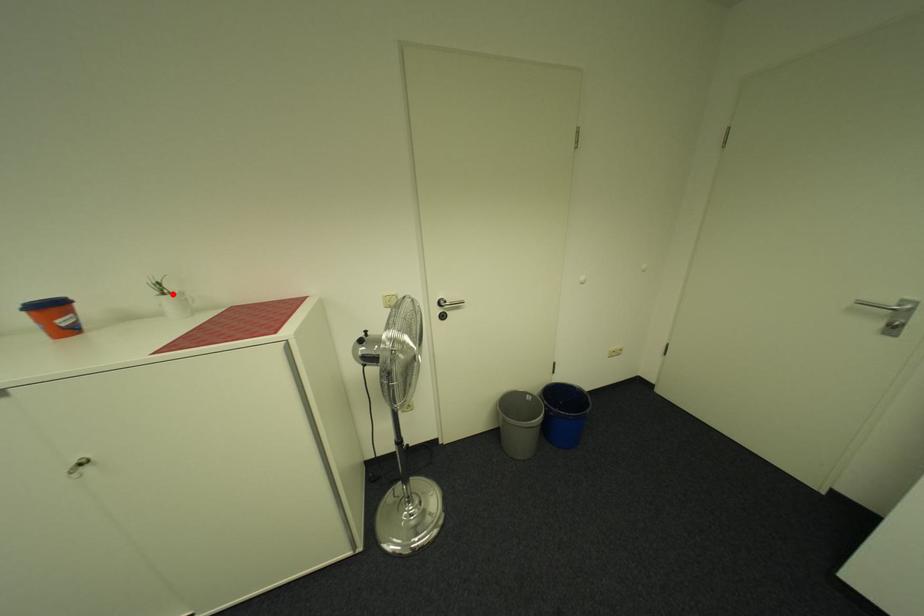
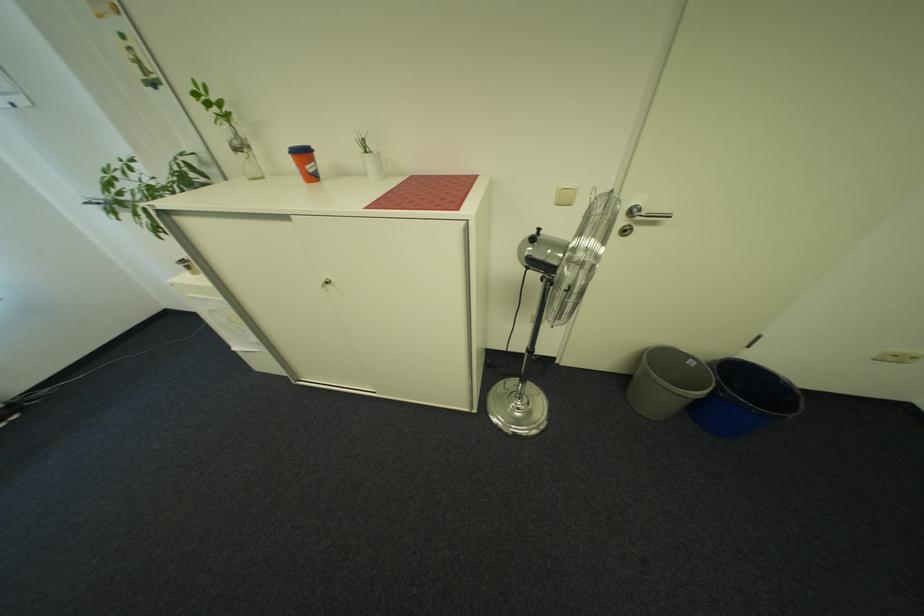
Where in the second image is the point corresponding to the highlighted location from the first image?

(375, 153)